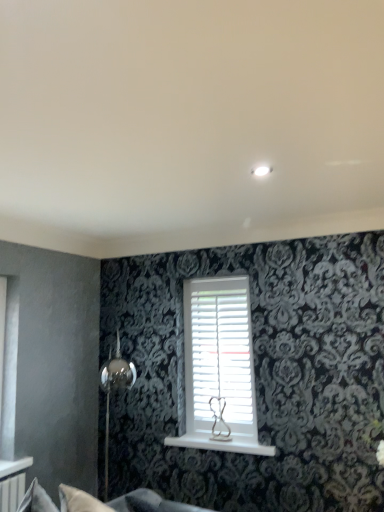
Where is `white matte shutter at center`? white matte shutter at center is located at coordinates click(x=221, y=354).

Locate an element on the screen. The width and height of the screenshot is (384, 512). soft gray fabric couch at lower left is located at coordinates (120, 502).

What do you see at coordinates (120, 502) in the screenshot?
I see `soft gray fabric couch at lower left` at bounding box center [120, 502].

Identify the location of white matte shutter at center. This screenshot has height=512, width=384. (221, 354).

From the image's perspective, is soft gray fabric couch at lower left above white glossy window sill at center?

Yes.

Is point (30, 510) positioned in front of point (236, 444)?

Yes, it is.

How different are the orientations of soft gray fabric couch at lower left and white glossy window sill at center in degrees?

soft gray fabric couch at lower left and white glossy window sill at center are facing 77.4 degrees away from each other.

Is soft gray fabric couch at lower left not within white glossy window sill at center?

soft gray fabric couch at lower left lies outside white glossy window sill at center's area.

From the image's perspective, is soft gray fabric couch at lower left located above white matte shutter at center?

No, from the image's perspective, soft gray fabric couch at lower left is not over white matte shutter at center.

Considering the relative sizes of soft gray fabric couch at lower left and white matte shutter at center in the image provided, is soft gray fabric couch at lower left thinner than white matte shutter at center?

In fact, soft gray fabric couch at lower left might be wider than white matte shutter at center.

Would you consider soft gray fabric couch at lower left to be distant from white matte shutter at center?

Yes, soft gray fabric couch at lower left and white matte shutter at center are quite far apart.

Find the location of a particular element. The image size is (384, 512). shutter on the right of white glossy window sill at center is located at coordinates (221, 354).

Considering the sizes of objects white glossy window sill at center and white matte shutter at center in the image provided, who is wider, white glossy window sill at center or white matte shutter at center?

With larger width is white glossy window sill at center.

From the image's perspective, is white glossy window sill at center located above or below white matte shutter at center?

Clearly, from the image's perspective, white glossy window sill at center is below white matte shutter at center.

From a real-world perspective, is white glossy window sill at center over white matte shutter at center?

No, from a real-world perspective, white glossy window sill at center is not above white matte shutter at center.

Do you think white matte shutter at center is within soft gray fabric couch at lower left, or outside of it?

The correct answer is: outside.

How many degrees apart are the facing directions of white matte shutter at center and soft gray fabric couch at lower left?

77.4 degrees separate the facing orientations of white matte shutter at center and soft gray fabric couch at lower left.

Considering the relative positions of white matte shutter at center and soft gray fabric couch at lower left in the image provided, is white matte shutter at center to the left of soft gray fabric couch at lower left from the viewer's perspective?

No, white matte shutter at center is not to the left of soft gray fabric couch at lower left.

Considering the relative sizes of white glossy window sill at center and soft gray fabric couch at lower left in the image provided, is white glossy window sill at center wider than soft gray fabric couch at lower left?

No.

Between white glossy window sill at center and soft gray fabric couch at lower left, which one has less height?

white glossy window sill at center.

Could you tell me if white glossy window sill at center is turned towards soft gray fabric couch at lower left?

Yes, white glossy window sill at center is turned towards soft gray fabric couch at lower left.

Is the depth of white glossy window sill at center less than that of soft gray fabric couch at lower left?

No, it is not.

Is white matte shutter at center wider or thinner than white glossy window sill at center?

Considering their sizes, white matte shutter at center looks slimmer than white glossy window sill at center.

From a real-world perspective, between white matte shutter at center and white glossy window sill at center, who is vertically higher?

In real-world perspective, white matte shutter at center is above.

Is white matte shutter at center smaller than white glossy window sill at center?

No, white matte shutter at center is not smaller than white glossy window sill at center.

Does point (238, 370) appear closer or farther from the camera than point (187, 439)?

Point (238, 370).

I want to click on window sill on the right of soft gray fabric couch at lower left, so click(220, 445).

Identify the location of couch that is below the white matte shutter at center (from the image's perspective). (120, 502).

Estimate the real-world distances between objects in this image. Which object is further from soft gray fabric couch at lower left, white matte shutter at center or white glossy window sill at center?

white matte shutter at center.

Estimate the real-world distances between objects in this image. Which object is further from white matte shutter at center, soft gray fabric couch at lower left or white glossy window sill at center?

soft gray fabric couch at lower left is positioned further to the anchor white matte shutter at center.

Estimate the real-world distances between objects in this image. Which object is closer to white glossy window sill at center, soft gray fabric couch at lower left or white matte shutter at center?

white matte shutter at center lies closer to white glossy window sill at center than the other object.

Which object lies nearer to the anchor point soft gray fabric couch at lower left, white glossy window sill at center or white matte shutter at center?

white glossy window sill at center lies closer to soft gray fabric couch at lower left than the other object.

Looking at the image, which one is located closer to white matte shutter at center, white glossy window sill at center or soft gray fabric couch at lower left?

white glossy window sill at center is closer to white matte shutter at center.

Estimate the real-world distances between objects in this image. Which object is closer to white glossy window sill at center, white matte shutter at center or soft gray fabric couch at lower left?

Based on the image, white matte shutter at center appears to be nearer to white glossy window sill at center.

The height and width of the screenshot is (512, 384). Identify the location of window sill between soft gray fabric couch at lower left and white matte shutter at center along the z-axis. (220, 445).